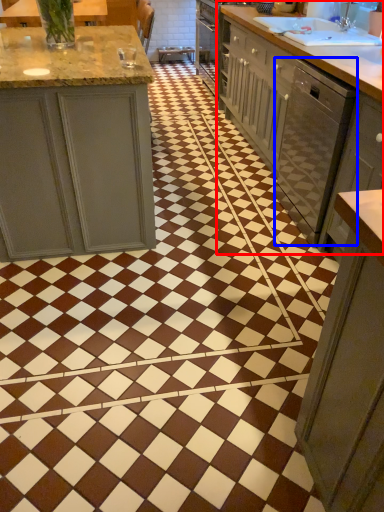
Question: Which object is closer to the camera taking this photo, countertop (highlighted by a red box) or dish washer (highlighted by a blue box)?

Choices:
 (A) countertop
 (B) dish washer

Answer: (B)